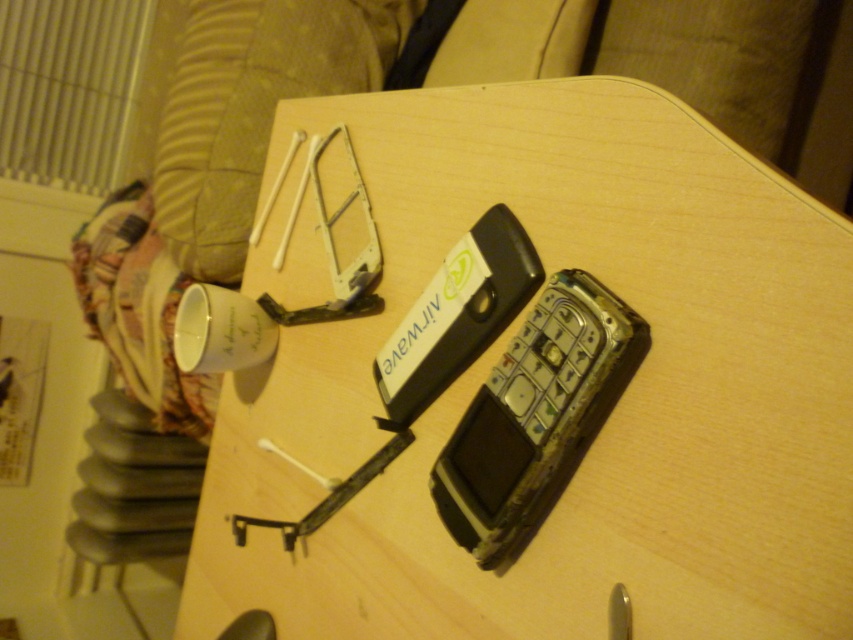
You are a technician working on a disassembled mobile phone on the wooden table at center. You need to place a small tool exactly at point (x=538, y=381). Is this point on the wooden table at center?

Yes, the point (x=538, y=381) is on the wooden table at center as stated in the objects description.

You are a repair technician working on the wooden table at center. You need to place a tool that is 10 cm tall on the table without it touching the rusty metallic phone at center. Is there enough vertical space between the table and the phone to do this?

The wooden table at center has a greater height compared to rusty metallic phone at center. Since the table is taller than the phone, there should be sufficient vertical space between them to place the tool without it touching the phone.

You are a technician working on the wooden table at center. You need to place a tool on the surface closest to the rusty metallic phone at center. Where should you put it?

The wooden table at center is to the left of the rusty metallic phone at center, so placing the tool on the right side of the wooden table at center would be closest to the rusty metallic phone at center.